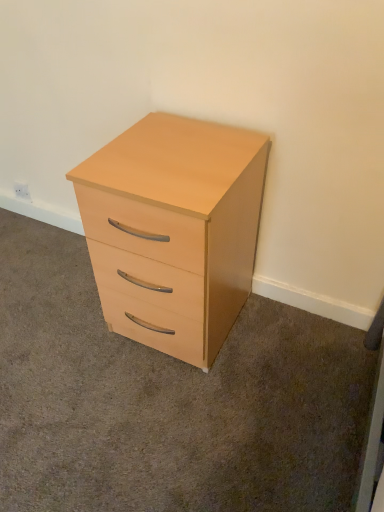
You are a GUI agent. You are given a task and a screenshot of the screen. Output one action in this format:
    pyautogui.click(x=<x>, y=<y>)
    Task: Click on the spots to the right of light wood/finish chest of drawers at center
    This screenshot has height=512, width=384.
    Given the screenshot: What is the action you would take?
    pyautogui.click(x=283, y=346)